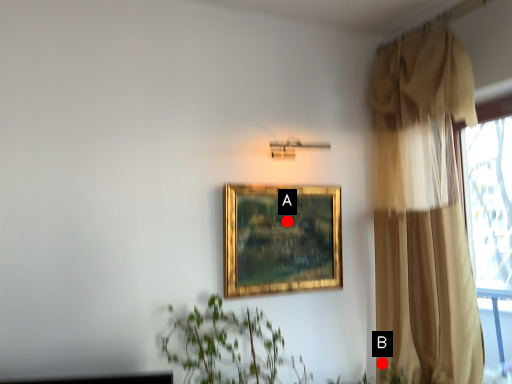
Question: Two points are circled on the image, labeled by A and B beside each circle. Among these points, which one is nearest to the camera?

Choices:
 (A) A is closer
 (B) B is closer

Answer: (A)